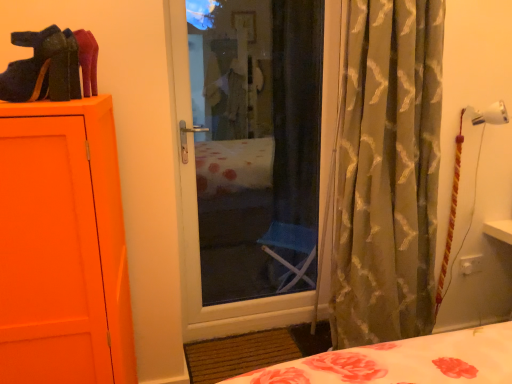
Question: Considering the positions of velvet-like black shoe at upper left and silky green curtain at right in the image, is velvet-like black shoe at upper left taller or shorter than silky green curtain at right?

Choices:
 (A) tall
 (B) short

Answer: (B)

Question: Relative to silky green curtain at right, is velvet-like black shoe at upper left in front or behind?

Choices:
 (A) behind
 (B) front

Answer: (B)

Question: In terms of size, does velvet-like black shoe at upper left appear bigger or smaller than silky green curtain at right?

Choices:
 (A) big
 (B) small

Answer: (B)

Question: Considering the positions of silky green curtain at right and velvet-like black shoe at upper left in the image, is silky green curtain at right wider or thinner than velvet-like black shoe at upper left?

Choices:
 (A) thin
 (B) wide

Answer: (B)

Question: Relative to velvet-like black shoe at upper left, is silky green curtain at right in front or behind?

Choices:
 (A) behind
 (B) front

Answer: (A)

Question: From the image's perspective, is silky green curtain at right located above or below velvet-like black shoe at upper left?

Choices:
 (A) below
 (B) above

Answer: (A)

Question: Visually, is silky green curtain at right positioned to the left or to the right of velvet-like black shoe at upper left?

Choices:
 (A) right
 (B) left

Answer: (A)